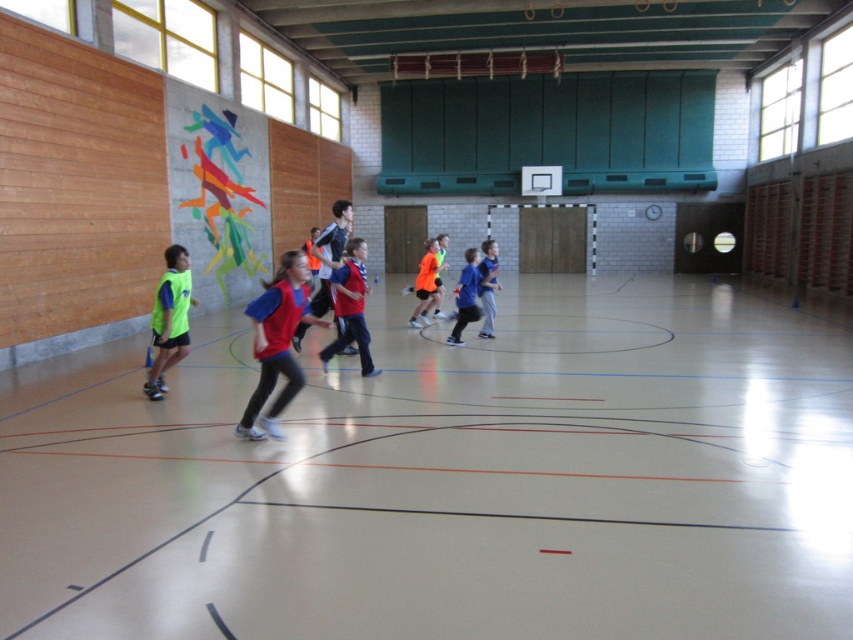
Question: Can you confirm if neon yellow jersey at left is positioned below matte red jersey at center?

Choices:
 (A) no
 (B) yes

Answer: (B)

Question: Among these points, which one is nearest to the camera?

Choices:
 (A) (252, 406)
 (B) (318, 301)
 (C) (437, 280)
 (D) (431, 272)

Answer: (A)

Question: Is matte red vest at center wider than neon orange jersey at center?

Choices:
 (A) no
 (B) yes

Answer: (B)

Question: Which point appears closest to the camera in this image?

Choices:
 (A) (438, 285)
 (B) (485, 272)
 (C) (267, 340)

Answer: (C)

Question: Is neon yellow jersey at left positioned behind orange matte jersey at center?

Choices:
 (A) no
 (B) yes

Answer: (A)

Question: Among these points, which one is farthest from the camera?

Choices:
 (A) (438, 246)
 (B) (463, 292)
 (C) (424, 268)

Answer: (A)